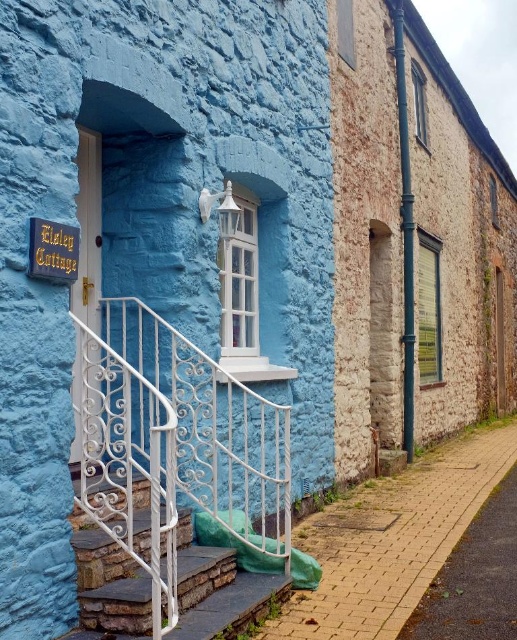
Who is taller, white wrought iron railing at lower left or white wrought iron stairs at lower left?

With more height is white wrought iron railing at lower left.

Which is in front, point (247, 388) or point (186, 612)?

Point (186, 612)

Locate an element on the screen. The image size is (517, 640). white wrought iron railing at lower left is located at coordinates (175, 444).